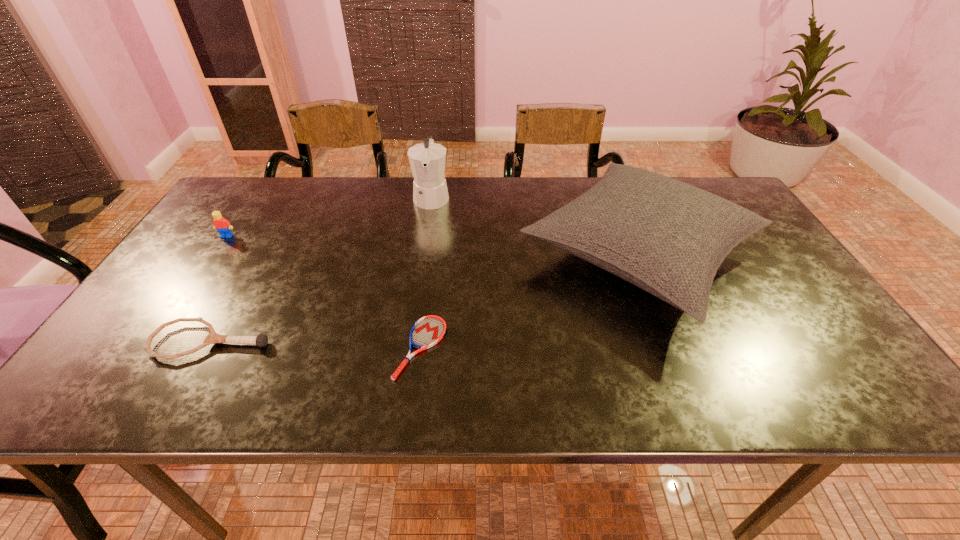
The image size is (960, 540). Find the location of `free point located on the back of the left tennis racket`. free point located on the back of the left tennis racket is located at coordinates (267, 243).

Locate an element on the screen. This screenshot has height=540, width=960. vacant point located on the left of the shorter tennis racket is located at coordinates (364, 348).

Locate an element on the screen. The width and height of the screenshot is (960, 540). coffeepot present at the far edge is located at coordinates (427, 160).

This screenshot has height=540, width=960. I want to click on cushion that is at the far edge, so click(669, 238).

Where is `object located in the near edge section of the desktop`? The image size is (960, 540). object located in the near edge section of the desktop is located at coordinates (429, 330).

The image size is (960, 540). I want to click on Lego at the left edge, so click(x=223, y=226).

Identify the location of tennis racket present at the left edge. (261, 340).

Identify the location of object at the right edge. (669, 238).

Identify the location of object located in the far right corner section of the desktop. (669, 238).

This screenshot has width=960, height=540. In order to click on vacant space at the far edge of the desktop in this screenshot , I will do `click(348, 204)`.